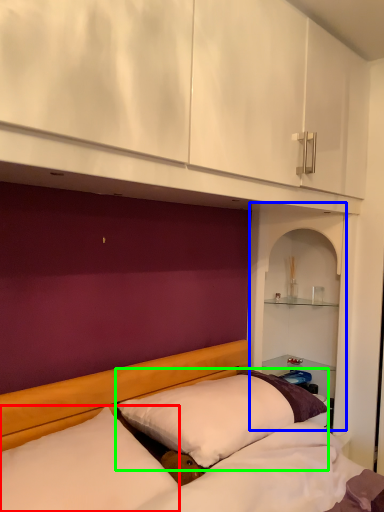
Question: Estimate the real-world distances between objects in this image. Which object is farther from pillow (highlighted by a red box), shelf (highlighted by a blue box) or pillow (highlighted by a green box)?

Choices:
 (A) shelf
 (B) pillow

Answer: (A)